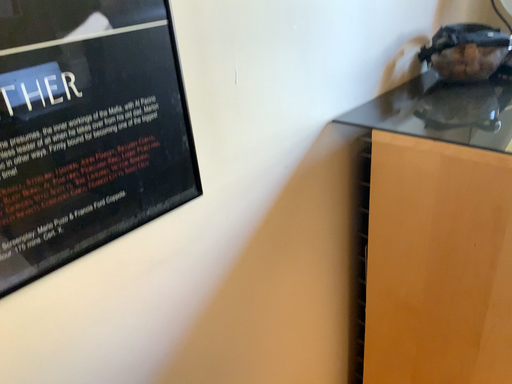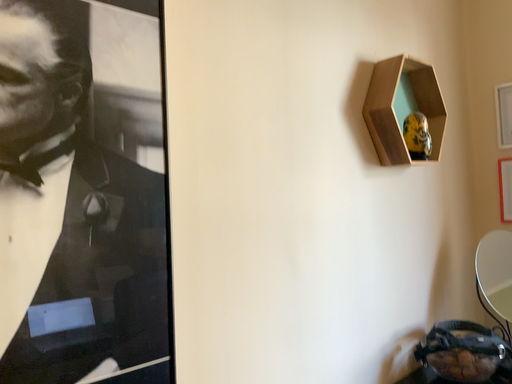
Question: How did the camera likely rotate when shooting the video?

Choices:
 (A) rotated upward
 (B) rotated downward

Answer: (A)